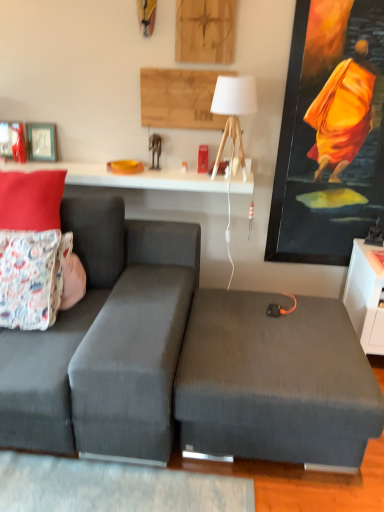
You are a GUI agent. You are given a task and a screenshot of the screen. Output one action in this format:
    pyautogui.click(x=<x>, y=<y>)
    Task: Click on the free space above dark gray fabric ottoman at center (from a real-world perspective)
    This screenshot has height=512, width=384.
    Given the screenshot: What is the action you would take?
    pyautogui.click(x=274, y=335)